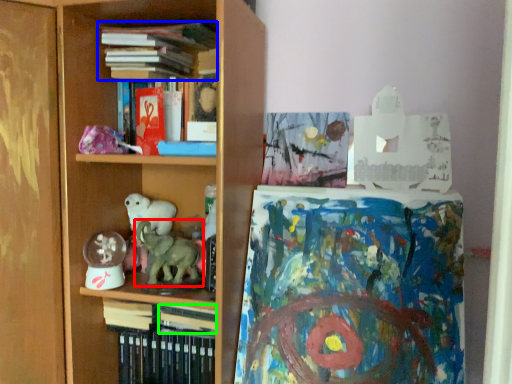
Question: Estimate the real-world distances between objects in this image. Which object is farther from animal (highlighted by a red box), book (highlighted by a blue box) or book (highlighted by a green box)?

Choices:
 (A) book
 (B) book

Answer: (A)